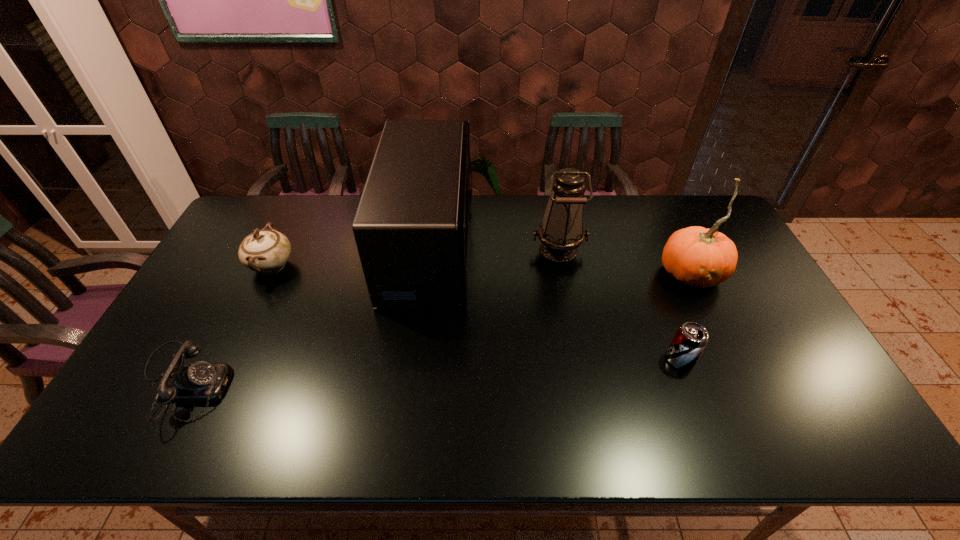
Identify the location of the third object from left to right. (411, 226).

Image resolution: width=960 pixels, height=540 pixels. Find the location of `the fourth object from left to right`. the fourth object from left to right is located at coordinates (561, 231).

Where is `pumpkin`? This screenshot has height=540, width=960. pumpkin is located at coordinates (698, 257).

The width and height of the screenshot is (960, 540). Find the location of `the third shortest object`. the third shortest object is located at coordinates (265, 251).

What are the coordinates of `the second shortest object` in the screenshot? It's located at (690, 340).

This screenshot has width=960, height=540. Find the location of `the shortest object`. the shortest object is located at coordinates (201, 382).

The width and height of the screenshot is (960, 540). Find the location of `vacant space situated 0.240m on the front-facing side of the microwave_oven`. vacant space situated 0.240m on the front-facing side of the microwave_oven is located at coordinates (544, 246).

What are the coordinates of `vacant space located 0.370m on the left of the fourth object from left to right` in the screenshot? It's located at (419, 249).

At what (x,y) coordinates should I click in order to perform the action: click on free space located on the back of the pumpkin. Please return your answer as a coordinate pair (x, y). Looking at the image, I should click on (674, 239).

At what (x,y) coordinates should I click in order to perform the action: click on vacant space located on the back of the fourth tallest object. Please return your answer as a coordinate pair (x, y). The height and width of the screenshot is (540, 960). Looking at the image, I should click on (286, 236).